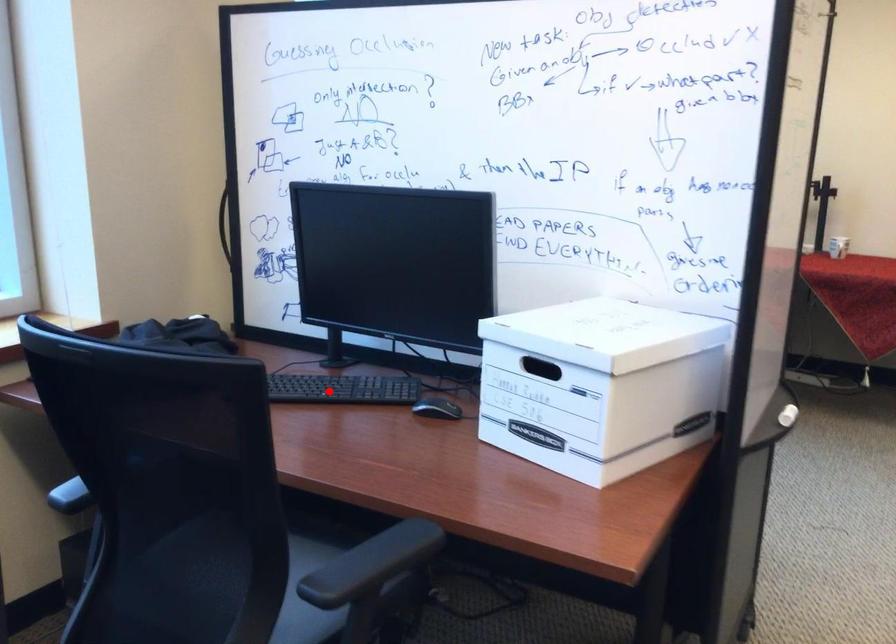
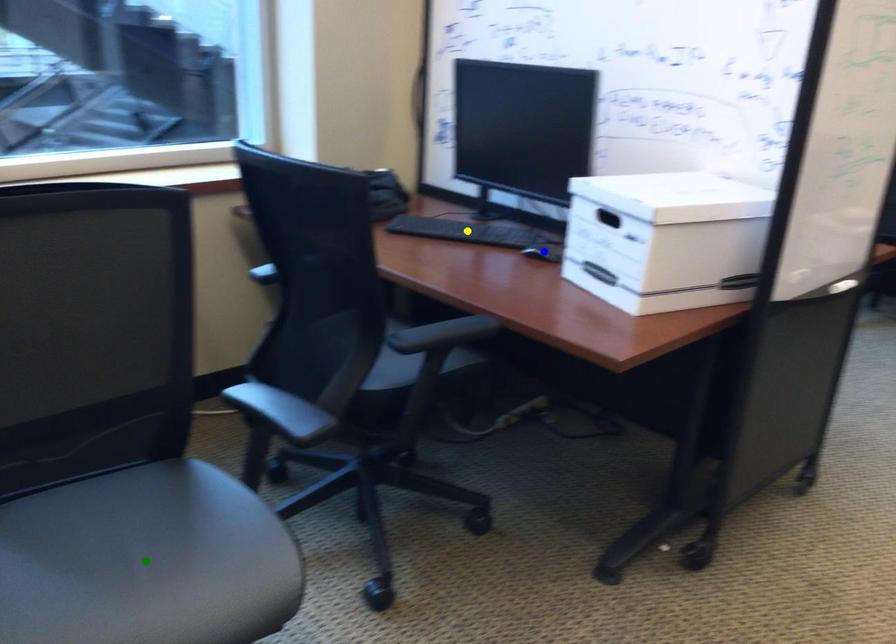
Question: I am providing you with two images of the same scene from different viewpoints. A red point is marked on the first image. You are given multiple points on the second image. Which mark in image 2 goes with the point in image 1?

Choices:
 (A) green point
 (B) yellow point
 (C) blue point

Answer: (B)